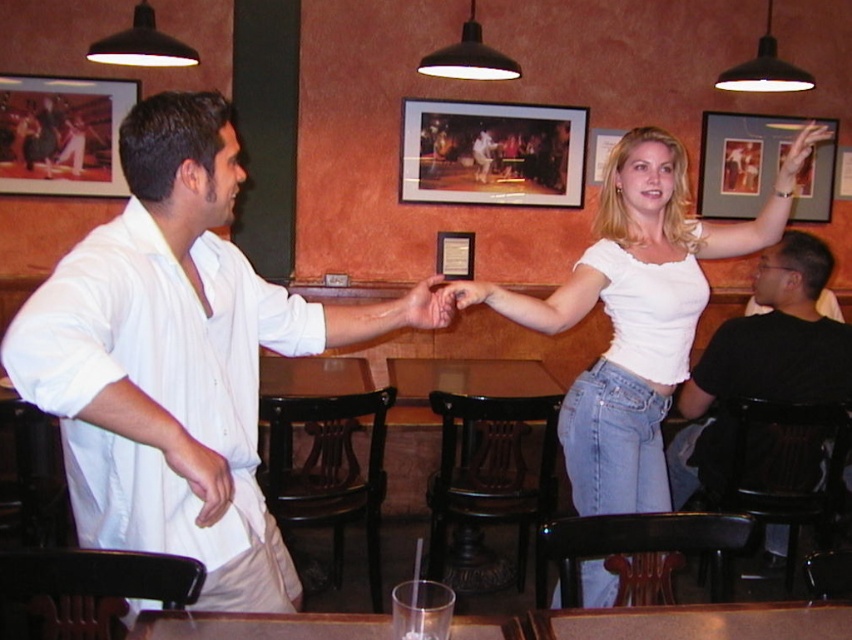
In the scene shown: Is white cotton top at upper right behind matte black picture frame at upper right?

No.

Is point (652, 474) more distant than point (797, 212)?

That is False.

Find the location of a particular element. This screenshot has width=852, height=640. white cotton top at upper right is located at coordinates (637, 314).

Between white cotton shirt at center and matte black picture frame at upper right, which one has more height?

Standing taller between the two is white cotton shirt at center.

Identify the location of white cotton shirt at center. (177, 358).

Who is more forward, (208, 458) or (711, 115)?

Point (208, 458) is in front.

Locate an element on the screen. white cotton shirt at center is located at coordinates (177, 358).

Who is more distant from viewer, (x=182, y=483) or (x=505, y=125)?

Point (x=505, y=125)

Which is above, white cotton shirt at center or matte wooden picture frame at center?

Positioned higher is matte wooden picture frame at center.

Identify the location of white cotton shirt at center. This screenshot has width=852, height=640. (177, 358).